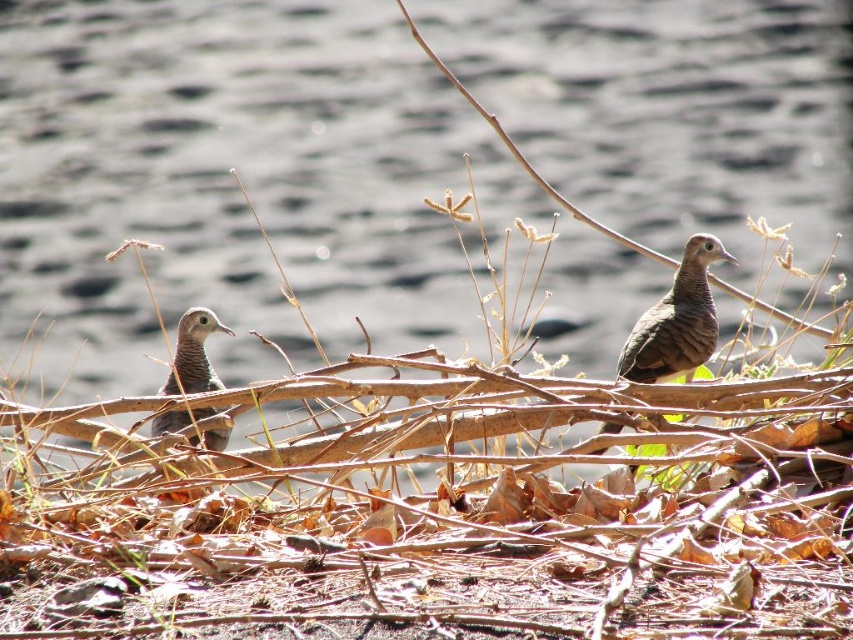
You are a birdwatcher observing the two birds with brown speckled feathers at center and brown speckled feathers at left in the dry environment. Which bird is positioned more to the right side of the scene?

The brown speckled feathers at center is positioned more to the right side of the scene compared to the brown speckled feathers at left.

Consider the image. You are a wildlife photographer trying to capture a closeup shot of the birds. You notice two areas with brown speckled feathers at center and brown speckled feathers at left. Which area should you focus on if you want to photograph the larger set of feathers?

The brown speckled feathers at center have a larger width than the brown speckled feathers at left, so you should focus on the brown speckled feathers at center to photograph the larger set of feathers.